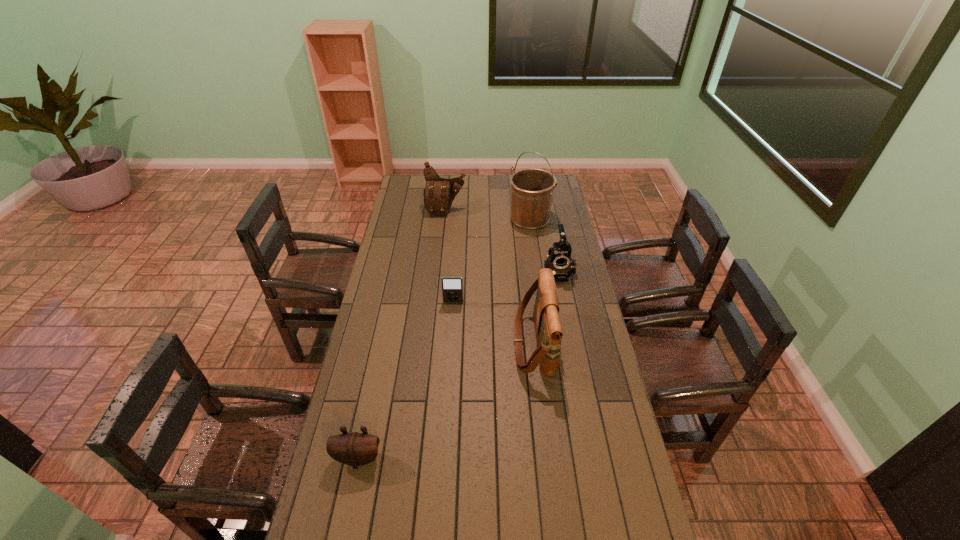
Where is `vacant space that's between the fourth tallest object and the leftmost object`? This screenshot has width=960, height=540. vacant space that's between the fourth tallest object and the leftmost object is located at coordinates (458, 365).

This screenshot has width=960, height=540. In order to click on free space between the left shoulder bag and the fourth farthest object in this screenshot , I will do `click(449, 256)`.

Where is `vacant region between the fourth farthest object and the farther shoulder bag`? This screenshot has height=540, width=960. vacant region between the fourth farthest object and the farther shoulder bag is located at coordinates (449, 256).

I want to click on unoccupied position between the bucket and the left shoulder bag, so click(x=488, y=214).

Identify which object is located as the fourth nearest to the leftmost object. Please provide its 2D coordinates. Your answer should be formatted as a tuple, i.e. [(x, y)], where the tuple contains the x and y coordinates of a point satisfying the conditions above.

[(532, 189)]

Where is `the fifth closest object to the third nearest object`? The width and height of the screenshot is (960, 540). the fifth closest object to the third nearest object is located at coordinates (355, 449).

At what (x,y) coordinates should I click in order to perform the action: click on free spot that satisfies the following two spatial constraints: 1. on the lens mount of the camcorder; 2. on the front-facing side of the nearer shoulder bag. Please return your answer as a coordinate pair (x, y). Looking at the image, I should click on (571, 343).